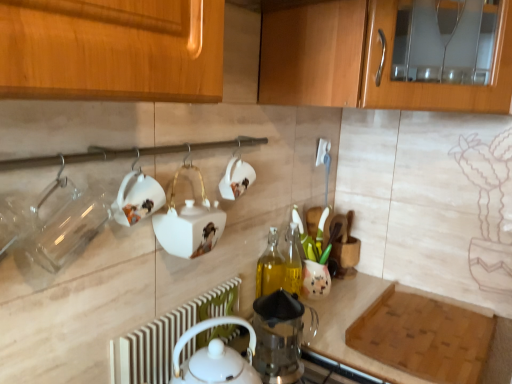
This screenshot has width=512, height=384. Describe the element at coordinates (362, 61) in the screenshot. I see `wooden cabinet at upper right` at that location.

Measure the distance between point (157, 333) and camera.

The distance of point (157, 333) from camera is 96.00 centimeters.

Where is `white glossy teapot at upper center, positioned as the second tableware in back-to-front order`? This screenshot has width=512, height=384. white glossy teapot at upper center, positioned as the second tableware in back-to-front order is located at coordinates (137, 198).

What is the approximate width of white glossy teapot at center, the first appliance in the left-to-right sequence?

5.34 inches.

I want to click on white glossy teapot at lower center, arranged as the 1th tea set when viewed from the front, so click(x=252, y=341).

What is the approximate width of transparent glass jar at left, arranged as the 1th tableware when viewed from the front?

transparent glass jar at left, arranged as the 1th tableware when viewed from the front, is 7.96 centimeters in width.

The height and width of the screenshot is (384, 512). Find the location of `matte ceramic tea set at center right, the 2th tea set viewed from the front`. matte ceramic tea set at center right, the 2th tea set viewed from the front is located at coordinates (314, 256).

Find the location of a particular element. bottle that appears in front of the matte ceramic tea set at center right, the 1th tea set in the back-to-front sequence is located at coordinates (270, 267).

Can you confirm if translucent glass bottle at center is wider than matte ceramic tea set at center right, positioned as the 2th tea set in left-to-right order?

No, translucent glass bottle at center is not wider than matte ceramic tea set at center right, positioned as the 2th tea set in left-to-right order.

Is translucent glass bottle at center bigger or smaller than matte ceramic tea set at center right, positioned as the 2th tea set in left-to-right order?

In the image, translucent glass bottle at center appears to be smaller than matte ceramic tea set at center right, positioned as the 2th tea set in left-to-right order.

Is translucent glass bottle at center not within matte ceramic tea set at center right, the 2th tea set viewed from the front?

Yes.

Is white glossy teapot at center, marked as the 2th appliance in a right-to-left arrangement, closer to camera compared to matte ceramic tea set at center right, the 2th tea set viewed from the front?

Yes, white glossy teapot at center, marked as the 2th appliance in a right-to-left arrangement, is in front of matte ceramic tea set at center right, the 2th tea set viewed from the front.

Which is correct: white glossy teapot at center, the first appliance in the left-to-right sequence, is inside matte ceramic tea set at center right, positioned as the 2th tea set in left-to-right order, or outside of it?

white glossy teapot at center, the first appliance in the left-to-right sequence, is outside matte ceramic tea set at center right, positioned as the 2th tea set in left-to-right order.

From their relative heights in the image, would you say white glossy teapot at center, the first appliance in the left-to-right sequence, is taller or shorter than matte ceramic tea set at center right, the 1th tea set in the back-to-front sequence?

white glossy teapot at center, the first appliance in the left-to-right sequence, is shorter than matte ceramic tea set at center right, the 1th tea set in the back-to-front sequence.

From a real-world perspective, is white glossy teapot at center, the 1th appliance viewed from the top, positioned under matte ceramic tea set at center right, the 1th tea set from the right, based on gravity?

No, from a real-world perspective, white glossy teapot at center, the 1th appliance viewed from the top, is not beneath matte ceramic tea set at center right, the 1th tea set from the right.

Are white glossy teapot at lower center, positioned as the first tea set in left-to-right order, and white glossy teapot at center, the 1th appliance viewed from the top, beside each other?

They are not placed beside each other.

From a real-world perspective, is white glossy teapot at lower center, arranged as the 1th tea set when viewed from the front, physically located above or below white glossy teapot at center, marked as the 2th appliance in a right-to-left arrangement?

Clearly, from a real-world perspective, white glossy teapot at lower center, arranged as the 1th tea set when viewed from the front, is below white glossy teapot at center, marked as the 2th appliance in a right-to-left arrangement.

Is white glossy teapot at lower center, arranged as the second tea set when viewed from the back, not inside white glossy teapot at center, the first appliance in the left-to-right sequence?

That's correct, white glossy teapot at lower center, arranged as the second tea set when viewed from the back, is outside of white glossy teapot at center, the first appliance in the left-to-right sequence.

Between white radiator at lower center and transparent glass jar at left, the 3th tableware when ordered from back to front, which one appears on the right side from the viewer's perspective?

From the viewer's perspective, white radiator at lower center appears more on the right side.

Which of these two, white radiator at lower center or transparent glass jar at left, the 3th tableware when ordered from back to front, is bigger?

With larger size is transparent glass jar at left, the 3th tableware when ordered from back to front.

Which object is more forward, white radiator at lower center or transparent glass jar at left, the 3th tableware when ordered from back to front?

transparent glass jar at left, the 3th tableware when ordered from back to front.

Can you confirm if white radiator at lower center is wider than transparent glass jar at left, arranged as the 1th tableware when viewed from the front?

No, white radiator at lower center is not wider than transparent glass jar at left, arranged as the 1th tableware when viewed from the front.

Considering the positions of objects white glossy cup at center, the first tableware in the right-to-left sequence, and translucent glass bottle at center in the image provided, who is in front, white glossy cup at center, the first tableware in the right-to-left sequence, or translucent glass bottle at center?

white glossy cup at center, the first tableware in the right-to-left sequence, is in front.

Looking at their sizes, would you say white glossy cup at center, arranged as the third tableware when viewed from the left, is wider or thinner than translucent glass bottle at center?

Considering their sizes, white glossy cup at center, arranged as the third tableware when viewed from the left, looks slimmer than translucent glass bottle at center.

From a real-world perspective, who is located higher, white glossy cup at center, placed as the 1th tableware when sorted from back to front, or translucent glass bottle at center?

white glossy cup at center, placed as the 1th tableware when sorted from back to front.

Find the location of `bottle below the white glossy cup at center, which is counted as the third tableware, starting from the front (from the image's perspective)`. bottle below the white glossy cup at center, which is counted as the third tableware, starting from the front (from the image's perspective) is located at coordinates (270, 267).

Is white glossy cup at center, arranged as the third tableware when viewed from the left, taller or shorter than transparent glass jar at left, arranged as the 1th tableware when viewed from the front?

Considering their sizes, white glossy cup at center, arranged as the third tableware when viewed from the left, has less height than transparent glass jar at left, arranged as the 1th tableware when viewed from the front.

From the image's perspective, is white glossy cup at center, the first tableware in the right-to-left sequence, under transparent glass jar at left, the 1th tableware positioned from the left?

No, from the image's perspective, white glossy cup at center, the first tableware in the right-to-left sequence, is not beneath transparent glass jar at left, the 1th tableware positioned from the left.

Is white glossy cup at center, which is counted as the third tableware, starting from the front, facing towards transparent glass jar at left, the 3th tableware when ordered from back to front?

No, white glossy cup at center, which is counted as the third tableware, starting from the front, is not aimed at transparent glass jar at left, the 3th tableware when ordered from back to front.

Which object is further away from the camera, white glossy cup at center, placed as the 1th tableware when sorted from back to front, or transparent glass jar at left, the 3th tableware positioned from the right?

white glossy cup at center, placed as the 1th tableware when sorted from back to front, is behind.

Considering the points (175, 371) and (154, 344), which point is behind, point (175, 371) or point (154, 344)?

Point (175, 371)

Does white glossy teapot at lower center, which ranks as the second tea set in right-to-left order, lie behind white radiator at lower center?

No, white glossy teapot at lower center, which ranks as the second tea set in right-to-left order, is in front of white radiator at lower center.

From the picture: Is white glossy teapot at lower center, which ranks as the second tea set in right-to-left order, looking in the opposite direction of white radiator at lower center?

That's right, white glossy teapot at lower center, which ranks as the second tea set in right-to-left order, is facing away from white radiator at lower center.

Are white glossy teapot at lower center, positioned as the first tea set in left-to-right order, and white radiator at lower center beside each other?

No, white glossy teapot at lower center, positioned as the first tea set in left-to-right order, is not making contact with white radiator at lower center.

I want to click on bottle that appears in front of the matte ceramic tea set at center right, the 2th tea set viewed from the front, so click(x=270, y=267).

Locate an element on the screen. appliance above the matte ceramic tea set at center right, the 1th tea set from the right (from a real-world perspective) is located at coordinates (189, 223).

Which object lies nearer to the anchor point white glossy teapot at upper center, positioned as the second tableware in back-to-front order, wooden cabinet at upper right or white radiator at lower center?

white radiator at lower center is positioned closer to the anchor white glossy teapot at upper center, positioned as the second tableware in back-to-front order.

Estimate the real-world distances between objects in this image. Which object is closer to white glossy teapot at center, the 1th appliance viewed from the top, transparent glass jar at left, arranged as the 1th tableware when viewed from the front, or white glossy cup at center, which is counted as the third tableware, starting from the front?

Based on the image, white glossy cup at center, which is counted as the third tableware, starting from the front, appears to be nearer to white glossy teapot at center, the 1th appliance viewed from the top.

Based on their spatial positions, is white glossy teapot at upper center, arranged as the 2th tableware when viewed from the front, or white glossy cup at center, the first tableware in the right-to-left sequence, further from white glossy teapot at lower center, arranged as the 1th tea set when viewed from the front?

white glossy teapot at upper center, arranged as the 2th tableware when viewed from the front, is further to white glossy teapot at lower center, arranged as the 1th tea set when viewed from the front.

Consider the image. Based on their spatial positions, is white glossy cup at center, the first tableware in the right-to-left sequence, or transparent glass coffee press at center, the second appliance viewed from the left, closer to white radiator at lower center?

transparent glass coffee press at center, the second appliance viewed from the left, lies closer to white radiator at lower center than the other object.

When comparing their distances from white glossy teapot at upper center, arranged as the 2th tableware when viewed from the front, does translucent glass bottle at center or white glossy cup at center, which is counted as the third tableware, starting from the front, seem closer?

white glossy cup at center, which is counted as the third tableware, starting from the front.

Estimate the real-world distances between objects in this image. Which object is further from translucent glass bottle at center, matte ceramic tea set at center right, the 2th tea set viewed from the front, or transparent glass coffee press at center, the 1th appliance in the bottom-to-top sequence?

transparent glass coffee press at center, the 1th appliance in the bottom-to-top sequence, is positioned further to the anchor translucent glass bottle at center.

Considering their positions, is white glossy cup at center, placed as the 1th tableware when sorted from back to front, positioned closer to matte ceramic tea set at center right, the 1th tea set from the right, than white glossy teapot at center, the first appliance in the left-to-right sequence?

The object closer to matte ceramic tea set at center right, the 1th tea set from the right, is white glossy cup at center, placed as the 1th tableware when sorted from back to front.

From the image, which object appears to be nearer to white glossy cup at center, arranged as the third tableware when viewed from the left, white glossy teapot at lower center, which ranks as the second tea set in right-to-left order, or matte ceramic tea set at center right, the 1th tea set from the right?

Based on the image, white glossy teapot at lower center, which ranks as the second tea set in right-to-left order, appears to be nearer to white glossy cup at center, arranged as the third tableware when viewed from the left.

Locate an element on the screen. bottle between wooden cabinet at upper right and white glossy teapot at lower center, arranged as the second tea set when viewed from the back, in the vertical direction is located at coordinates (270, 267).

At what (x,y) coordinates should I click in order to perform the action: click on radiator between white glossy teapot at center, marked as the 2th appliance in a right-to-left arrangement, and white glossy teapot at lower center, arranged as the second tea set when viewed from the back, from top to bottom. Please return your answer as a coordinate pair (x, y). The image size is (512, 384). Looking at the image, I should click on (166, 337).

Where is `appliance between white glossy teapot at center, marked as the 2th appliance in a right-to-left arrangement, and white radiator at lower center, in the vertical direction`? The height and width of the screenshot is (384, 512). appliance between white glossy teapot at center, marked as the 2th appliance in a right-to-left arrangement, and white radiator at lower center, in the vertical direction is located at coordinates (278, 337).

The width and height of the screenshot is (512, 384). I want to click on bottle between transparent glass jar at left, the 1th tableware positioned from the left, and matte ceramic tea set at center right, the 1th tea set in the back-to-front sequence, in the front-back direction, so point(270,267).